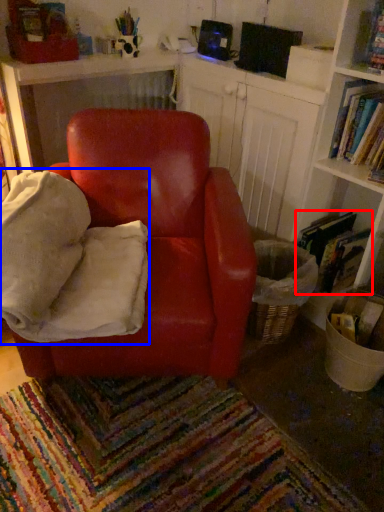
Question: Which object is closer to the camera taking this photo, book (highlighted by a red box) or bean bag chair (highlighted by a blue box)?

Choices:
 (A) book
 (B) bean bag chair

Answer: (B)